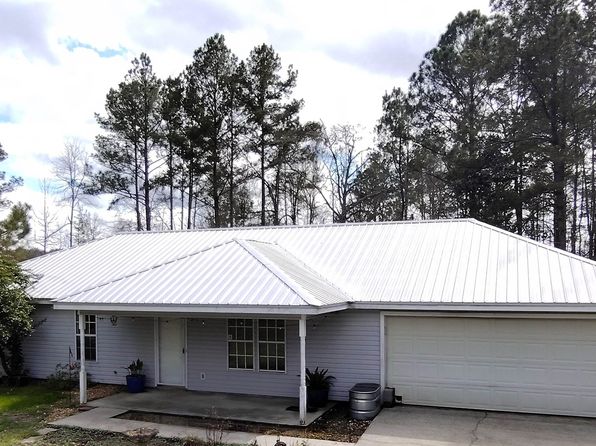
Locate an element on the screen. This screenshot has height=446, width=596. windows is located at coordinates (243, 342), (275, 352), (91, 340).